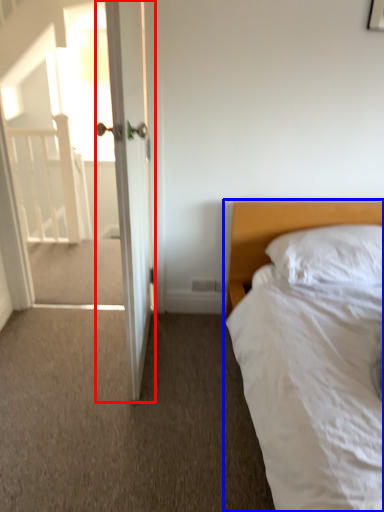
Question: Which object is closer to the camera taking this photo, door (highlighted by a red box) or bed (highlighted by a blue box)?

Choices:
 (A) door
 (B) bed

Answer: (B)